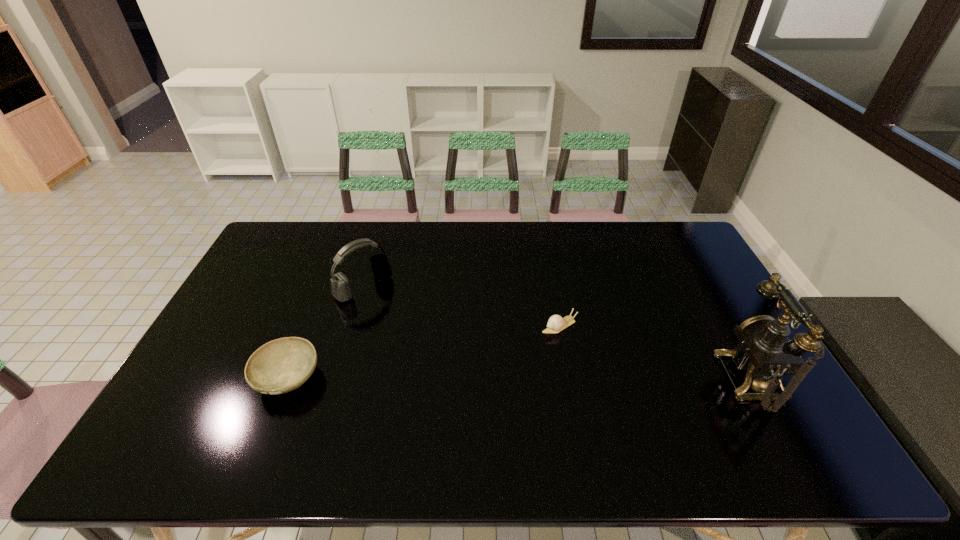
Image resolution: width=960 pixels, height=540 pixels. In order to click on vacant space located 0.080m on the headband of the headset in this screenshot , I will do `click(393, 314)`.

Where is `vacant space located on the shell of the shortest object`? This screenshot has height=540, width=960. vacant space located on the shell of the shortest object is located at coordinates (442, 396).

You are a GUI agent. You are given a task and a screenshot of the screen. Output one action in this format:
    pyautogui.click(x=<x>, y=<y>)
    Task: Click on the vacant space located on the shell of the shortest object
    
    Given the screenshot: What is the action you would take?
    pyautogui.click(x=507, y=355)

This screenshot has height=540, width=960. In order to click on free space located on the shell of the shortest object in this screenshot , I will do `click(438, 398)`.

The width and height of the screenshot is (960, 540). Find the location of `bowl situated at the near edge`. bowl situated at the near edge is located at coordinates (282, 365).

At what (x,y) coordinates should I click in order to perform the action: click on telephone located in the near edge section of the desktop. Please return your answer as a coordinate pair (x, y). Looking at the image, I should click on (765, 352).

I want to click on object that is at the right edge, so click(765, 352).

Image resolution: width=960 pixels, height=540 pixels. What are the coordinates of `object situated at the near right corner` in the screenshot? It's located at (765, 352).

Image resolution: width=960 pixels, height=540 pixels. What are the coordinates of `vacant space at the far edge of the desktop` in the screenshot? It's located at [615, 251].

Identify the location of free region at the near edge of the desktop. The width and height of the screenshot is (960, 540). (502, 409).